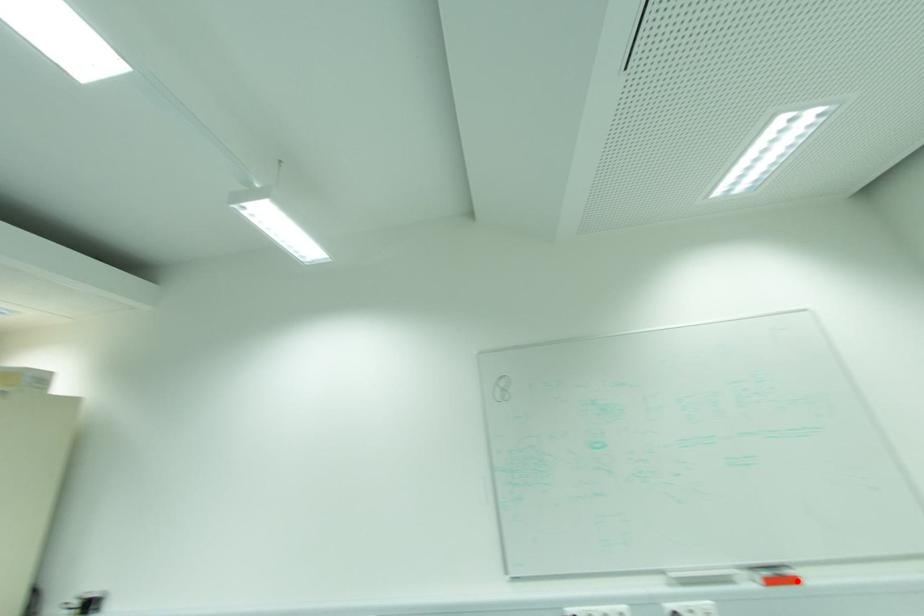
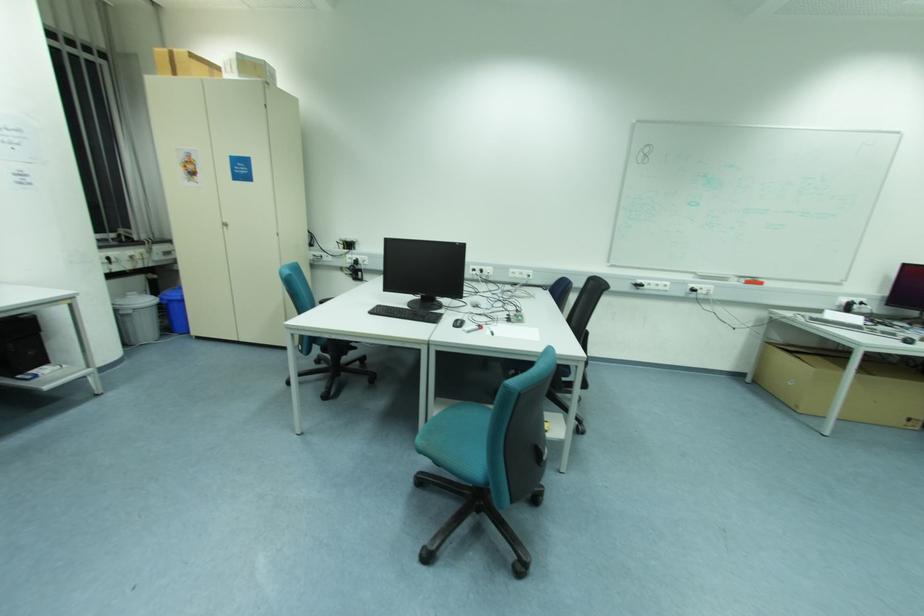
Find the pixel in the second image that matches the highlighted location in the first image.

(761, 284)